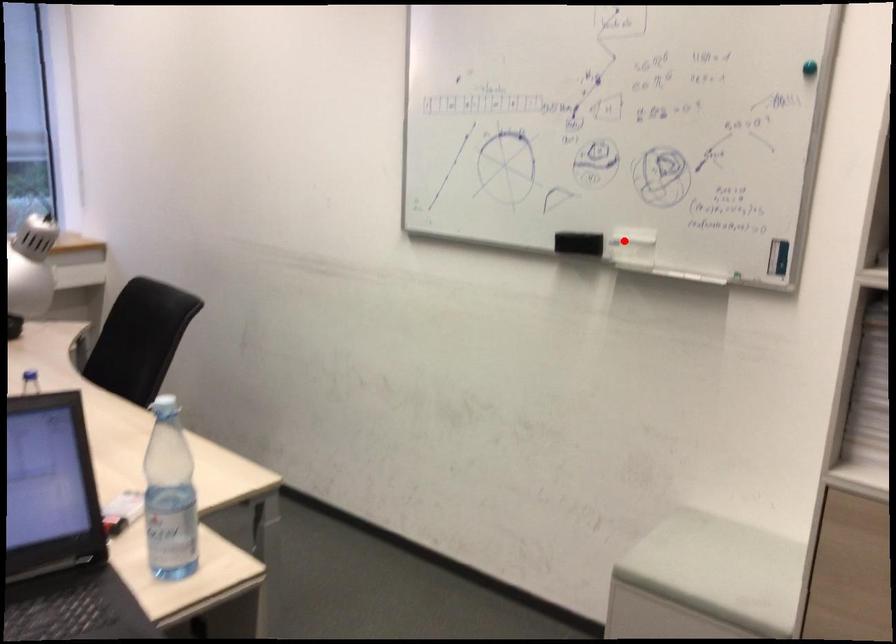
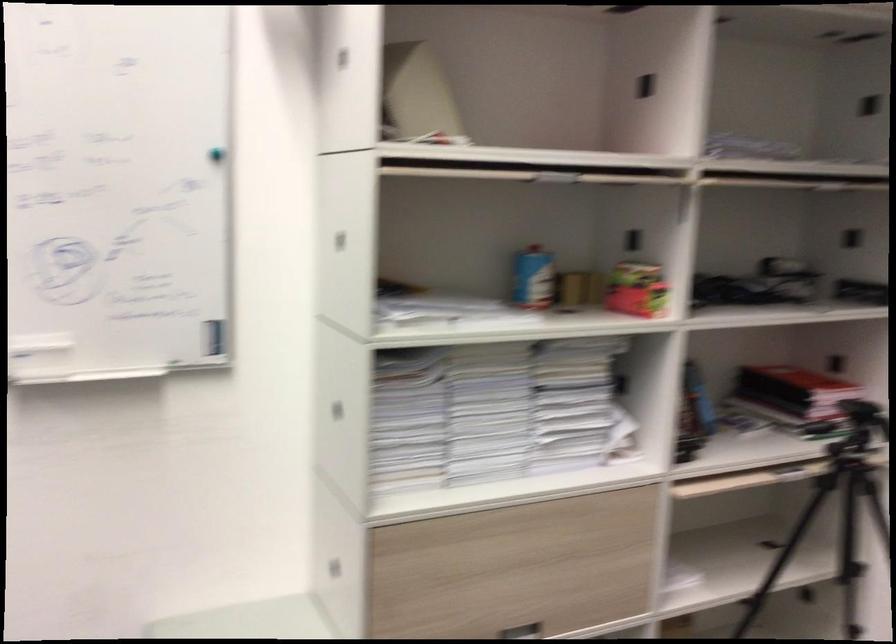
Question: I am providing you with two images of the same scene from different viewpoints. Given a red point in image1, look at the same physical point in image2. Is it:

Choices:
 (A) Closer to the viewpoint
 (B) Farther from the viewpoint

Answer: (A)